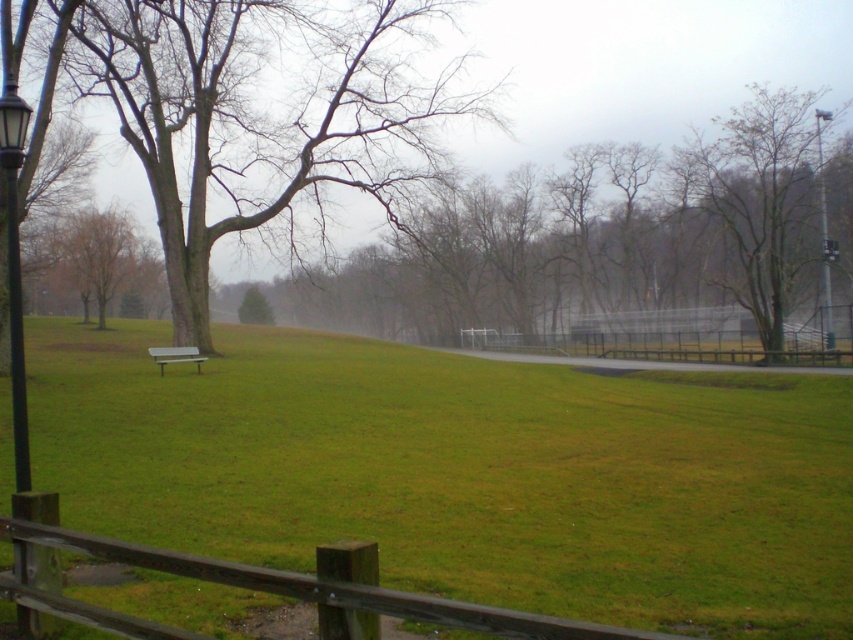
Question: Which point is closer to the camera taking this photo?

Choices:
 (A) (567, 284)
 (B) (795, 548)
 (C) (134, 22)
 (D) (810, 248)

Answer: (B)

Question: Which object is positioned farthest from the brown bark tree at left?

Choices:
 (A) metallic silver bench at center
 (B) black metal lamp post at left

Answer: (B)

Question: Does green grassy field at center have a greater width compared to metallic pole at upper right?

Choices:
 (A) yes
 (B) no

Answer: (A)

Question: Which of the following is the closest to the observer?

Choices:
 (A) (195, 356)
 (B) (16, 326)
 (C) (804, 248)
 (D) (822, 214)

Answer: (B)

Question: Does bare branches at center have a greater width compared to bare wood tree at right?

Choices:
 (A) yes
 (B) no

Answer: (A)

Question: Can you confirm if black metal lamp post at left is positioned above metallic silver bench at center?

Choices:
 (A) no
 (B) yes

Answer: (B)